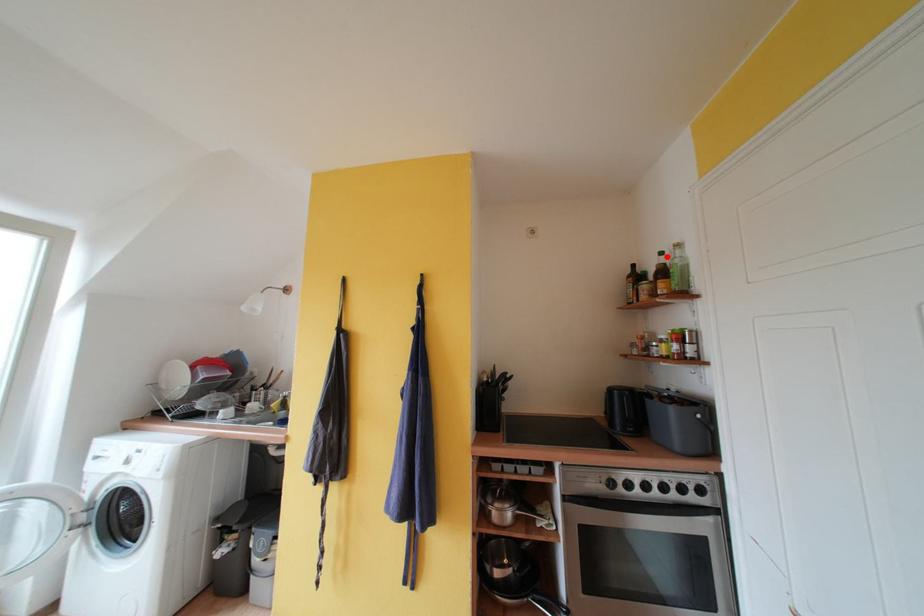
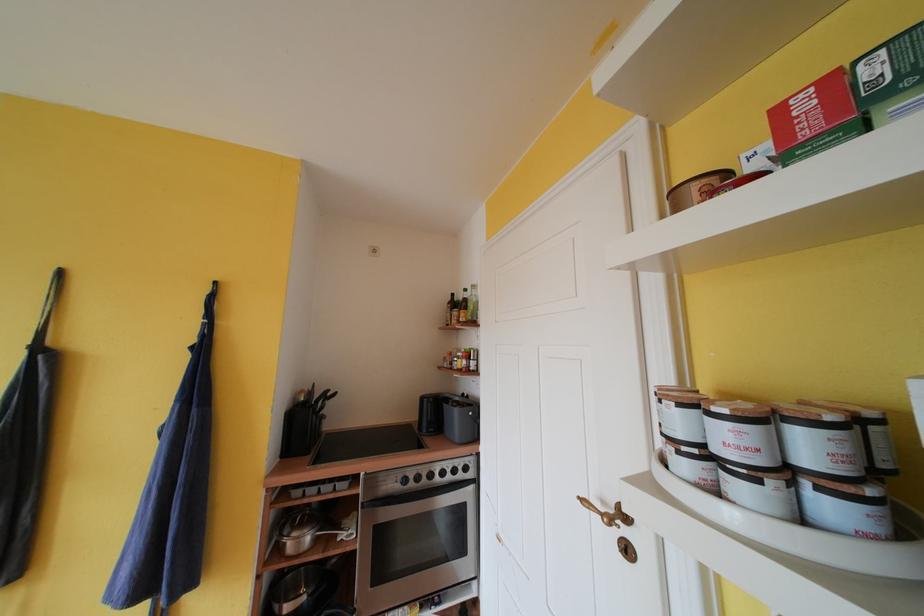
The point at the highlighted location is marked in the first image. Where is the corresponding point in the second image?

(471, 294)